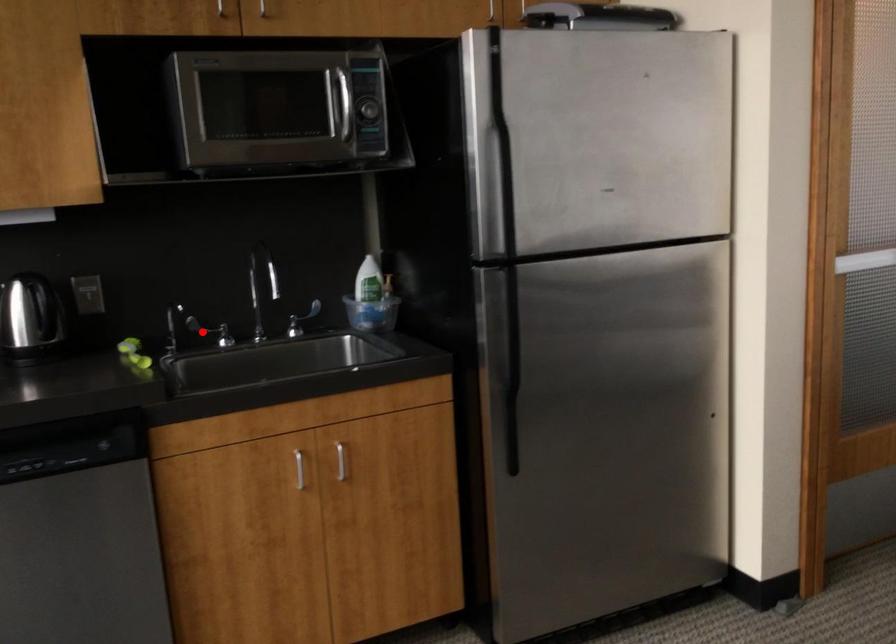
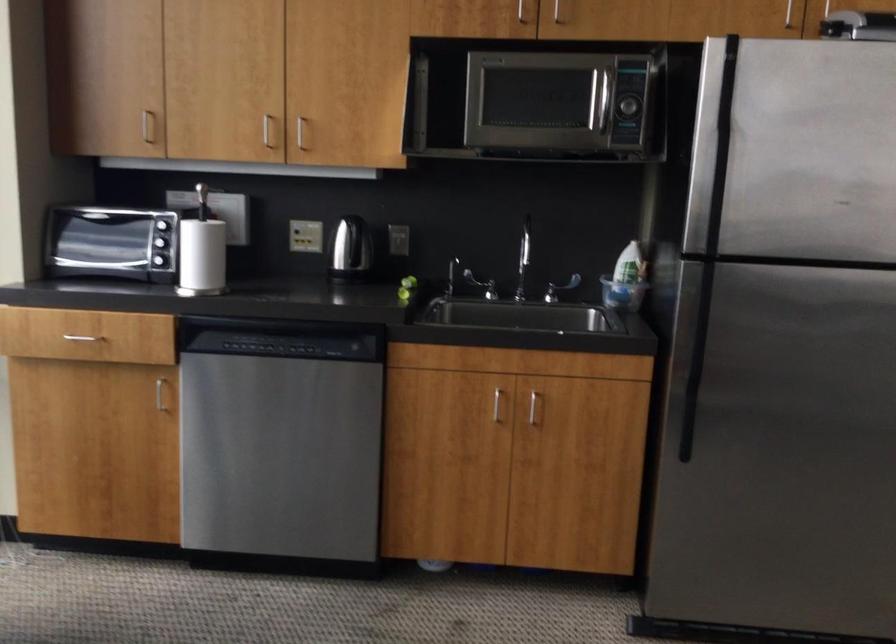
The point at the highlighted location is marked in the first image. Where is the corresponding point in the second image?

(480, 285)